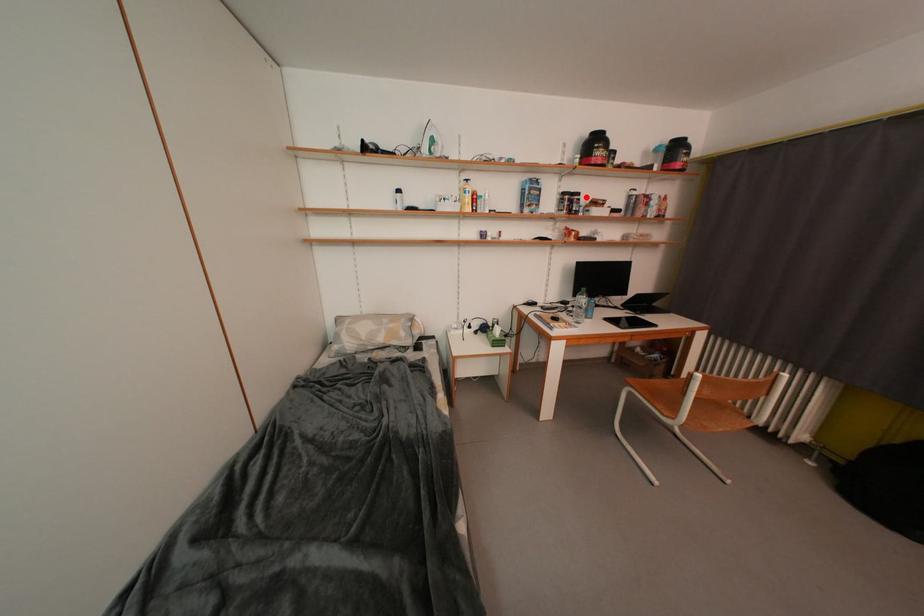
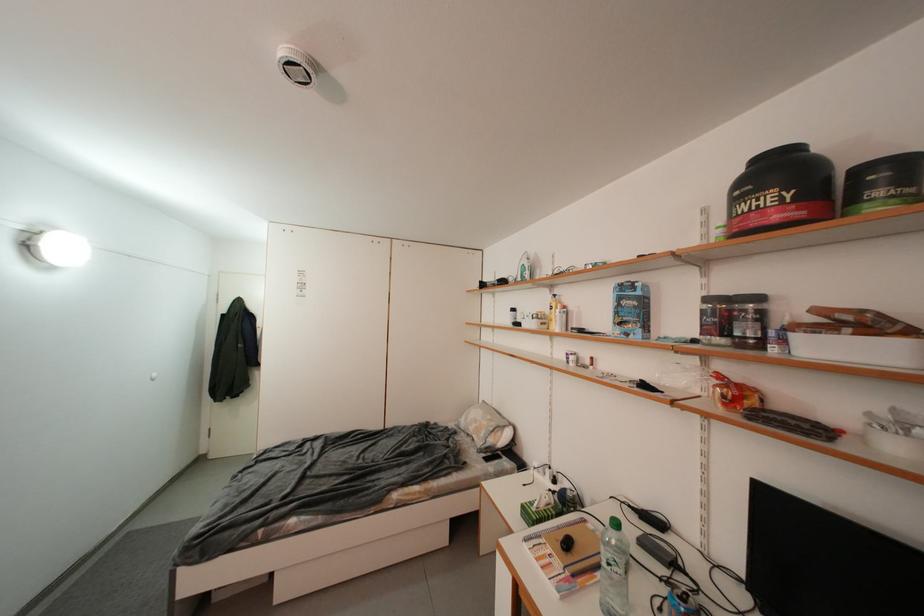
In the second image, find the point that corresponds to the highlighted location in the first image.

(766, 301)